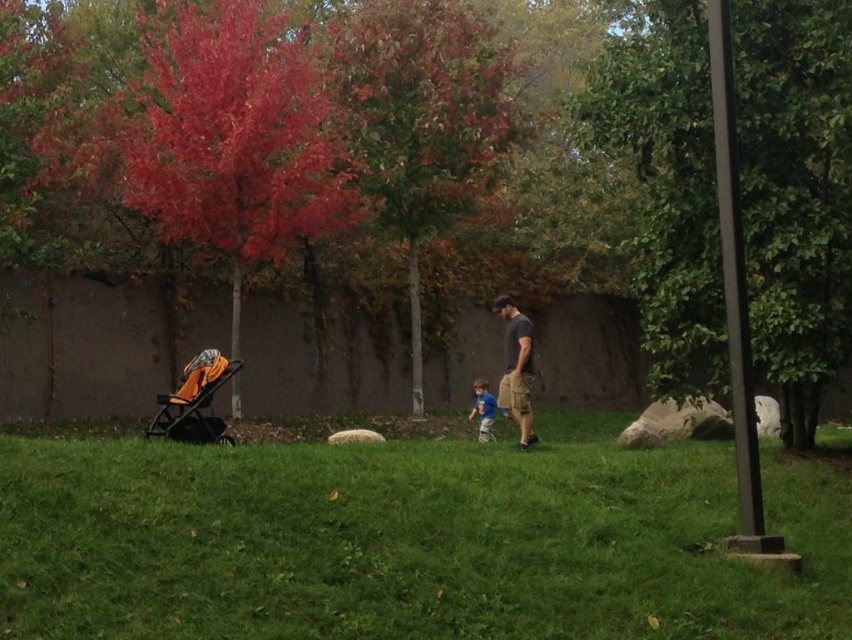
Question: Is green leafy tree at right above reddish-brown bark tree at center?

Choices:
 (A) no
 (B) yes

Answer: (A)

Question: Does red matte tree at upper left appear over orange fabric baby carriage at lower left?

Choices:
 (A) yes
 (B) no

Answer: (A)

Question: Which object appears closest to the camera in this image?

Choices:
 (A) green grass at center
 (B) orange fabric baby carriage at lower left
 (C) dark gray/cargo shorts at center
 (D) reddish-brown bark tree at center

Answer: (A)

Question: Which object appears closest to the camera in this image?

Choices:
 (A) orange fabric baby carriage at lower left
 (B) blue cotton shirt at center
 (C) green leafy tree at right
 (D) green grass at center

Answer: (D)

Question: Estimate the real-world distances between objects in this image. Which object is farther from the blue cotton shirt at center?

Choices:
 (A) reddish-brown bark tree at center
 (B) red matte tree at upper left
 (C) green leafy tree at right

Answer: (B)

Question: Considering the relative positions of green grass at center and reddish-brown bark tree at center in the image provided, where is green grass at center located with respect to reddish-brown bark tree at center?

Choices:
 (A) left
 (B) right

Answer: (B)